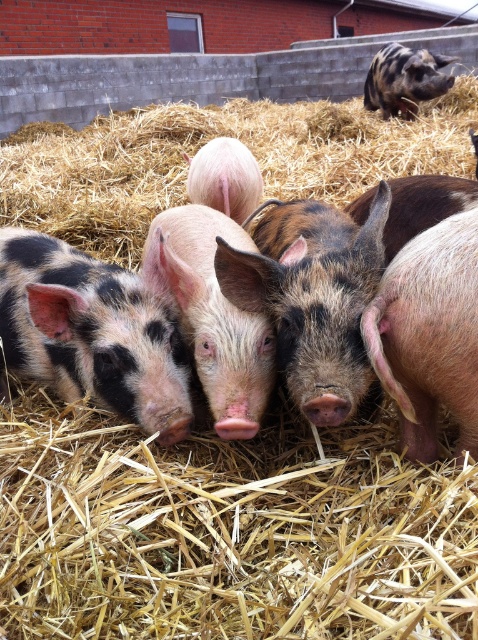
You are a farmer standing at the edge of the pig pen. You notice a point marked at coordinates (208, 140). What is located at that point?

The point at coordinates (208, 140) marks golden straw at center.